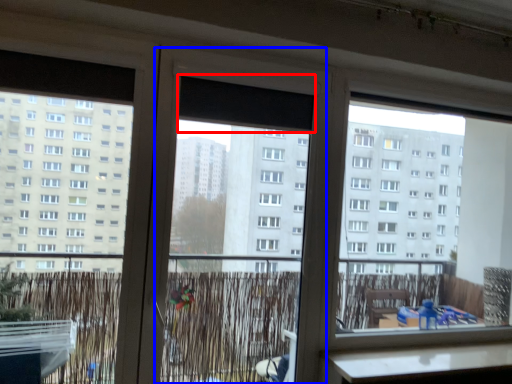
Question: Among these objects, which one is farthest to the camera, window screen (highlighted by a red box) or screen door (highlighted by a blue box)?

Choices:
 (A) window screen
 (B) screen door

Answer: (A)